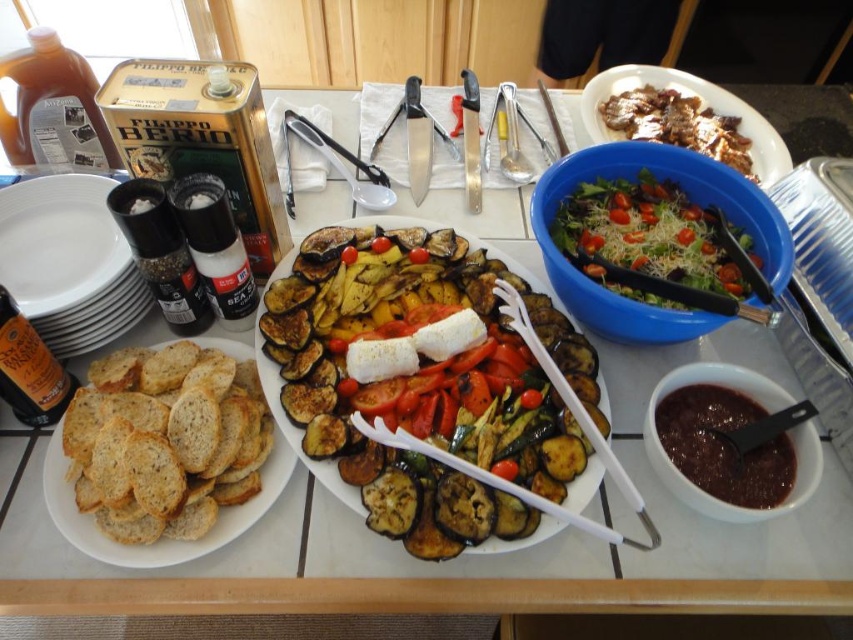
Question: Considering the relative positions of white ceramic plate at left and grilled vegetables at center in the image provided, where is white ceramic plate at left located with respect to grilled vegetables at center?

Choices:
 (A) below
 (B) above

Answer: (B)

Question: From the image, what is the correct spatial relationship of white ceramic plate at left in relation to green leafy salad at upper right?

Choices:
 (A) above
 (B) below

Answer: (B)

Question: Which object is positioned closest to the green leafy salad at upper right?

Choices:
 (A) white ceramic plate at left
 (B) grilled vegetables at center
 (C) matte brown bowl at lower right

Answer: (B)

Question: In this image, where is grilled vegetables at center located relative to green leafy salad at upper right?

Choices:
 (A) left
 (B) right

Answer: (A)

Question: Which object is positioned farthest from the matte brown bowl at lower right?

Choices:
 (A) blue plastic bowl at upper right
 (B) green leafy salad at upper right
 (C) brown crumbly bread at left

Answer: (C)

Question: Which object appears closest to the camera in this image?

Choices:
 (A) white ceramic plate at left
 (B) blue plastic bowl at upper right
 (C) green leafy salad at upper right
 (D) matte brown bowl at lower right

Answer: (D)